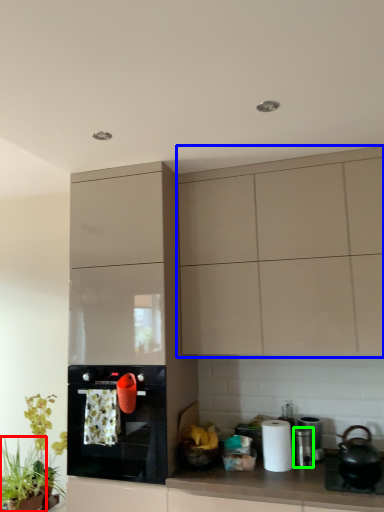
Question: Estimate the real-world distances between objects in this image. Which object is closer to plant (highlighted by a red box), cabinetry (highlighted by a blue box) or appliance (highlighted by a green box)?

Choices:
 (A) cabinetry
 (B) appliance

Answer: (B)